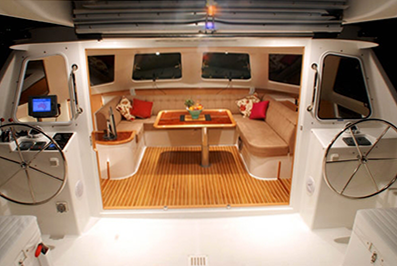
Locate an element on the screen. The width and height of the screenshot is (397, 266). table stand leg is located at coordinates (206, 154).